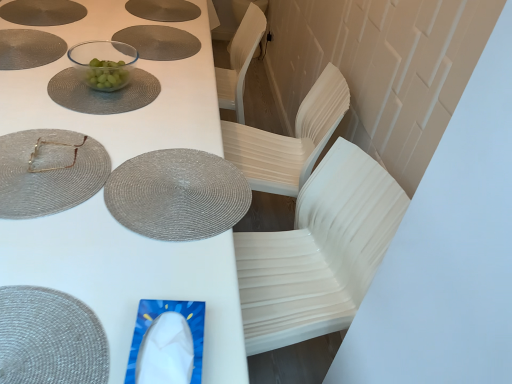
Identify the location of unoccupied region to the right of clear glass bowl at upper center, marked as the first tableware in a back-to-front arrangement. The width and height of the screenshot is (512, 384). click(154, 93).